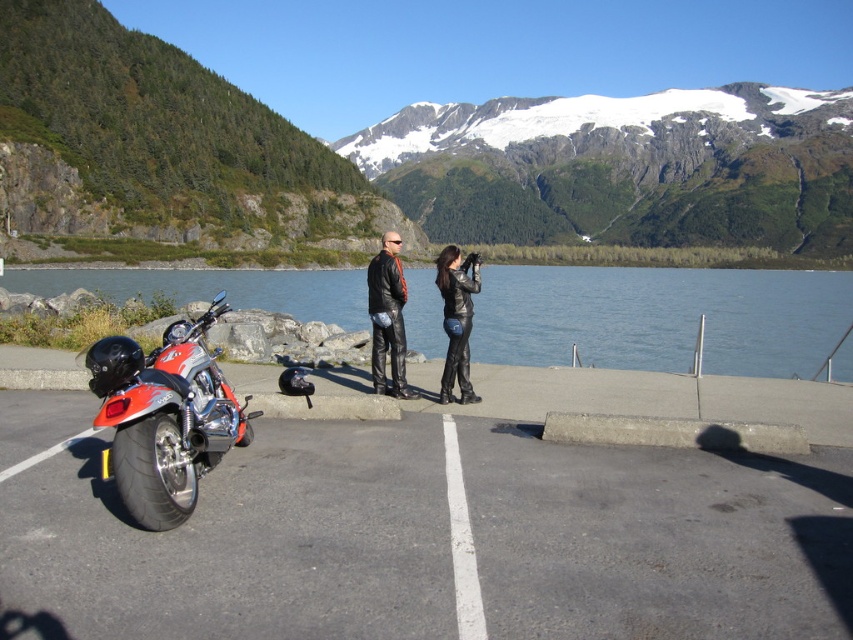
Is point (808, 476) positioned after point (450, 268)?

No, (808, 476) is in front of (450, 268).

Can you confirm if smooth asphalt parking lot at lower left is taller than black leather jacket at center?

Incorrect, smooth asphalt parking lot at lower left's height is not larger of black leather jacket at center's.

Who is more distant from viewer, (10, 630) or (454, 321)?

The point (454, 321) is more distant.

Locate an element on the screen. This screenshot has height=640, width=853. smooth asphalt parking lot at lower left is located at coordinates (437, 540).

Can you confirm if clear water at center is smaller than black leather jacket at center?

No.

Can you confirm if clear water at center is shorter than black leather jacket at center?

No.

Find the location of a particular element. This screenshot has width=853, height=640. clear water at center is located at coordinates (660, 317).

Image resolution: width=853 pixels, height=640 pixels. In order to click on clear water at center in this screenshot , I will do point(660,317).

Is point (491, 157) behind point (183, 380)?

Yes, point (491, 157) is behind point (183, 380).

Consider the image. Who is more forward, [717,243] or [152,385]?

Positioned in front is point [152,385].

I want to click on snowy granite mountain at upper center, so click(624, 168).